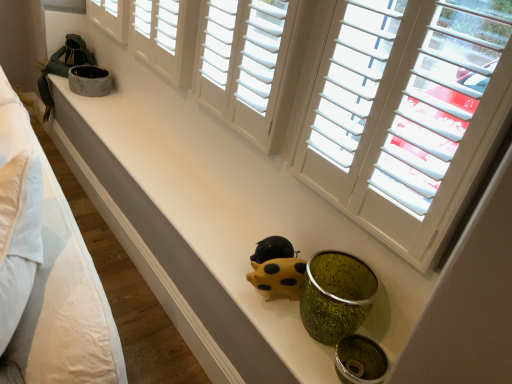
Question: Is white cotton bed at left oriented away from yellow matte piggy bank at center?

Choices:
 (A) no
 (B) yes

Answer: (B)

Question: From the image's perspective, is white cotton bed at left located beneath yellow matte piggy bank at center?

Choices:
 (A) yes
 (B) no

Answer: (B)

Question: From a real-world perspective, is white cotton bed at left on yellow matte piggy bank at center?

Choices:
 (A) no
 (B) yes

Answer: (B)

Question: Is white cotton bed at left positioned far away from yellow matte piggy bank at center?

Choices:
 (A) no
 (B) yes

Answer: (A)

Question: Is white cotton bed at left shorter than yellow matte piggy bank at center?

Choices:
 (A) no
 (B) yes

Answer: (A)

Question: Does white cotton bed at left have a larger size compared to yellow matte piggy bank at center?

Choices:
 (A) yes
 (B) no

Answer: (A)

Question: Can you confirm if white wood shutters at upper center, the first window viewed from the left, is wider than matte white counter top at center?

Choices:
 (A) yes
 (B) no

Answer: (B)

Question: Is the depth of white wood shutters at upper center, the first window viewed from the left, less than that of matte white counter top at center?

Choices:
 (A) no
 (B) yes

Answer: (A)

Question: From a real-world perspective, is white wood shutters at upper center, which appears as the second window when viewed from the right, physically below matte white counter top at center?

Choices:
 (A) no
 (B) yes

Answer: (A)

Question: Can you confirm if white wood shutters at upper center, the first window viewed from the left, is positioned to the left of matte white counter top at center?

Choices:
 (A) no
 (B) yes

Answer: (A)

Question: Does white wood shutters at upper center, which appears as the second window when viewed from the right, appear on the right side of matte white counter top at center?

Choices:
 (A) no
 (B) yes

Answer: (B)

Question: From a real-world perspective, is white wood shutters at upper center, the first window viewed from the left, over matte white counter top at center?

Choices:
 (A) yes
 (B) no

Answer: (A)

Question: Can you confirm if yellow matte piggy bank at center is smaller than white wood shutters at upper center, which appears as the second window when viewed from the right?

Choices:
 (A) no
 (B) yes

Answer: (B)